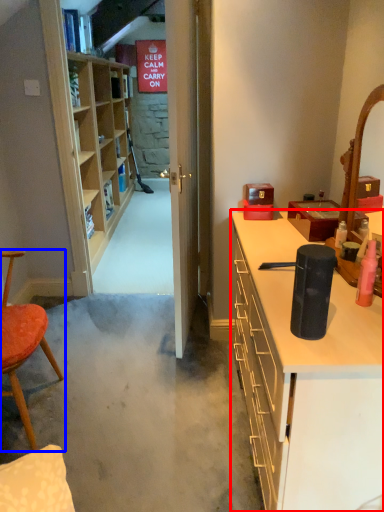
Question: Which of the following is the closest to the observer, cabinetry (highlighted by a red box) or chair (highlighted by a blue box)?

Choices:
 (A) cabinetry
 (B) chair

Answer: (A)